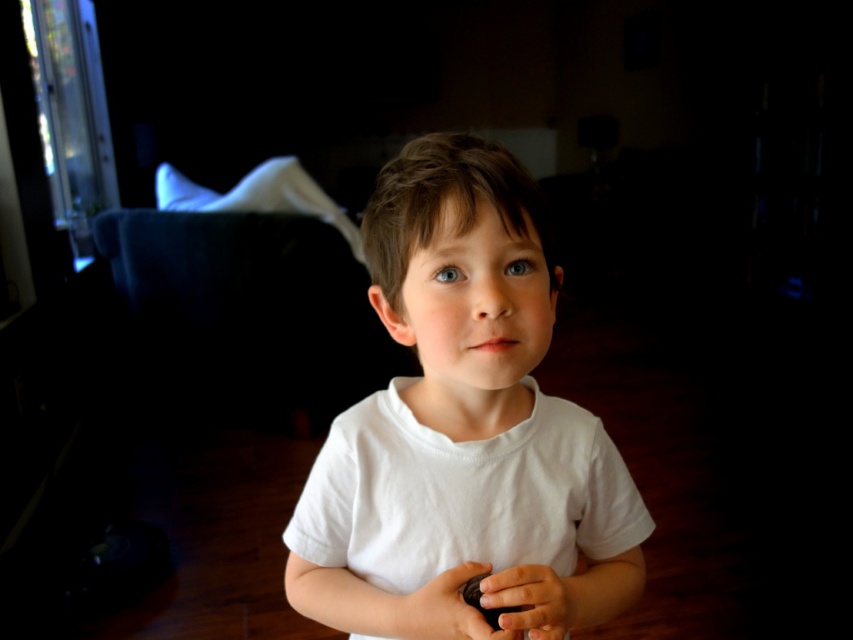
Does white cotton shirt at center have a lesser width compared to smooth brown object at center?

No, white cotton shirt at center is not thinner than smooth brown object at center.

From the picture: Measure the distance between white cotton shirt at center and camera.

The distance of white cotton shirt at center from camera is 21.87 inches.

This screenshot has height=640, width=853. What are the coordinates of `white cotton shirt at center` in the screenshot? It's located at (461, 412).

Between smooth brown object at center and smooth skin hand at center, which one has more height?

smooth brown object at center is taller.

Is point (463, 570) positioned behind point (538, 628)?

Yes, point (463, 570) is behind point (538, 628).

Where is `smooth brown object at center`? The width and height of the screenshot is (853, 640). smooth brown object at center is located at coordinates (447, 611).

Does white cotton shirt at center appear over smooth skin hand at center?

Yes, white cotton shirt at center is above smooth skin hand at center.

Does white cotton shirt at center appear on the left side of smooth skin hand at center?

Yes, white cotton shirt at center is to the left of smooth skin hand at center.

Is point (364, 435) positioned after point (544, 588)?

Yes, point (364, 435) is behind point (544, 588).

Locate an element on the screen. white cotton shirt at center is located at coordinates (461, 412).